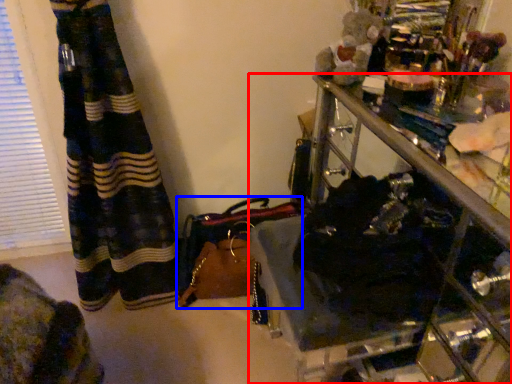
Question: Which point is further to the camera, furniture (highlighted by a red box) or handbag (highlighted by a blue box)?

Choices:
 (A) furniture
 (B) handbag

Answer: (B)